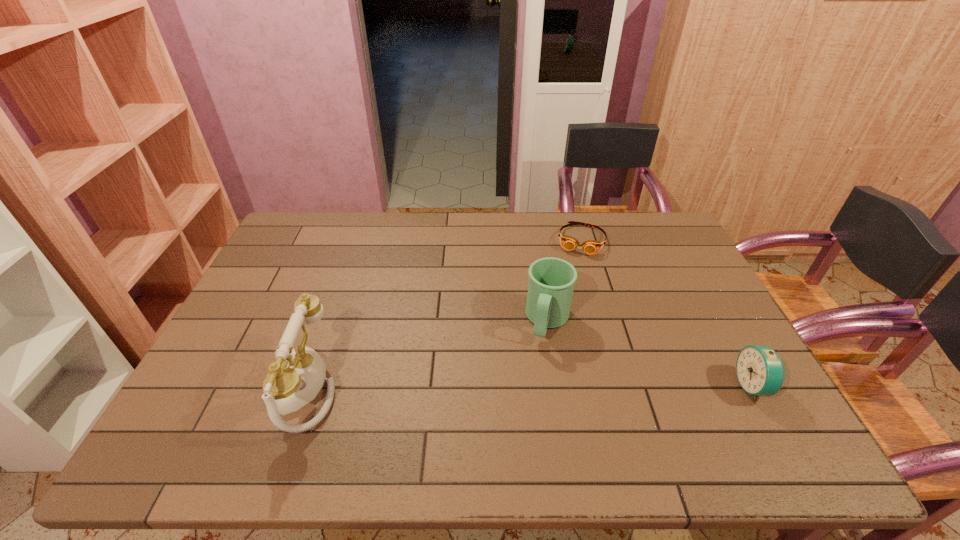
Find the location of a particular element. object situated at the far edge is located at coordinates (590, 247).

The height and width of the screenshot is (540, 960). I want to click on telephone that is positioned at the near edge, so click(x=297, y=376).

In order to click on alarm clock at the near edge in this screenshot , I will do `click(760, 371)`.

The height and width of the screenshot is (540, 960). Find the location of `object situated at the right edge`. object situated at the right edge is located at coordinates (760, 371).

Where is `object located at the near right corner`? object located at the near right corner is located at coordinates (760, 371).

This screenshot has width=960, height=540. Identify the location of vacant position at the far edge of the desktop. (568, 228).

Find the location of a particular element. free space at the near edge of the desktop is located at coordinates (613, 400).

In the image, there is a desktop. What are the coordinates of `vacant area at the left edge` in the screenshot? It's located at (264, 291).

Identify the location of blank space at the right edge of the desktop. Image resolution: width=960 pixels, height=540 pixels. (693, 289).

Where is `free location at the far left corner`? free location at the far left corner is located at coordinates (331, 220).